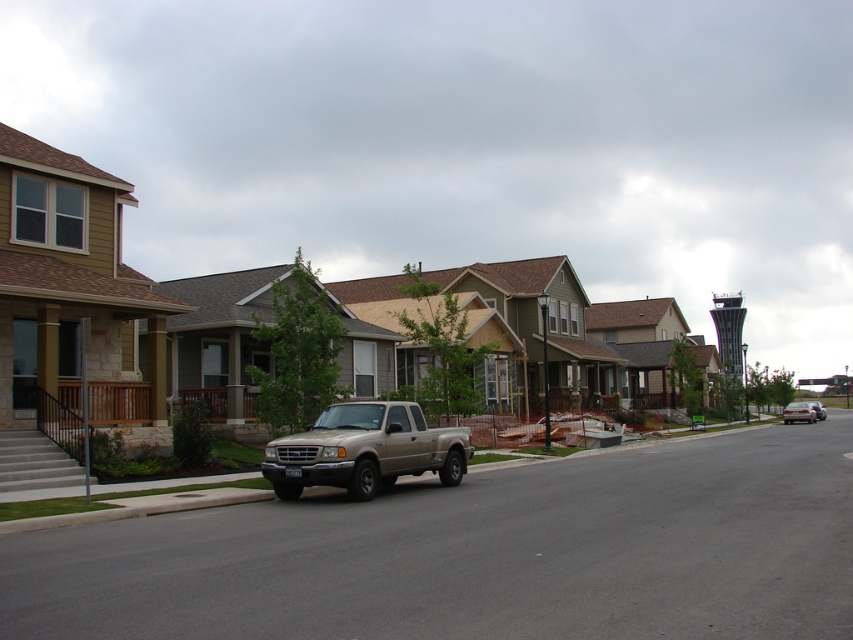
Does silver metallic sedan at right come in front of metallic silver sedan at center?

Yes, it is.

Which is in front, point (807, 403) or point (817, 406)?

Point (817, 406) is more forward.

The height and width of the screenshot is (640, 853). Find the location of `silver metallic sedan at right`. silver metallic sedan at right is located at coordinates click(798, 412).

Is gold metallic truck at center to the left of silver metallic sedan at right from the viewer's perspective?

Yes, gold metallic truck at center is to the left of silver metallic sedan at right.

Which is behind, point (457, 429) or point (788, 404)?

Positioned behind is point (788, 404).

I want to click on gold metallic truck at center, so click(x=364, y=451).

Between gold metallic truck at center and metallic silver sedan at center, which one has more height?

Standing taller between the two is metallic silver sedan at center.

Between gold metallic truck at center and metallic silver sedan at center, which one is positioned lower?

metallic silver sedan at center is lower down.

Image resolution: width=853 pixels, height=640 pixels. What are the coordinates of `gold metallic truck at center` in the screenshot? It's located at (364, 451).